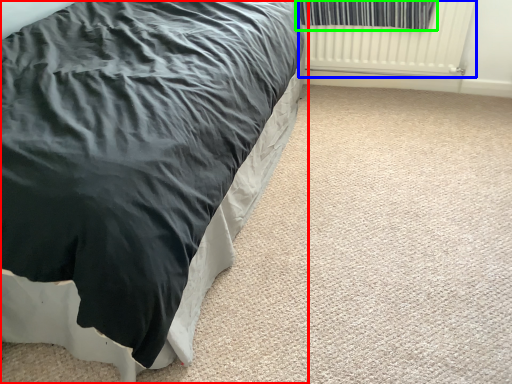
Question: Based on their relative distances, which object is nearer to bed (highlighted by a red box)? Choose from radiator (highlighted by a blue box) and curtain (highlighted by a green box).

Choices:
 (A) radiator
 (B) curtain

Answer: (B)